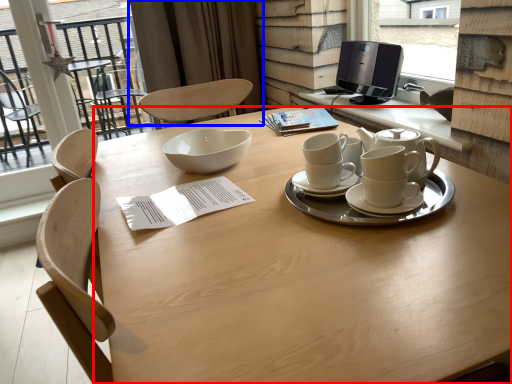
Question: Which point is further to the camera, desk (highlighted by a red box) or curtain (highlighted by a blue box)?

Choices:
 (A) desk
 (B) curtain

Answer: (B)